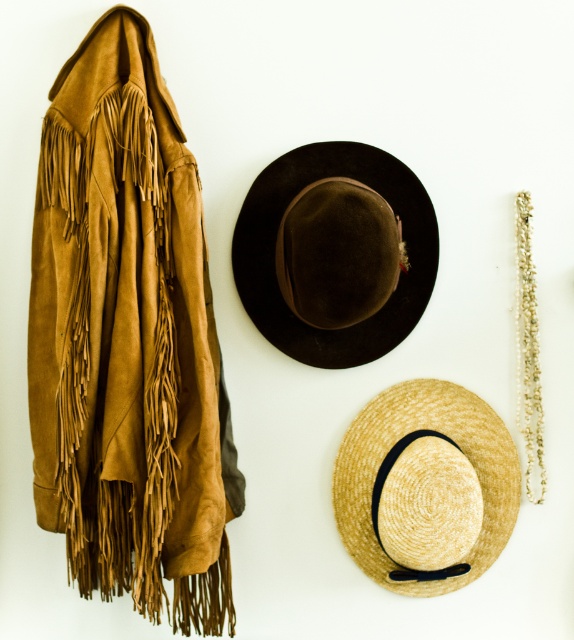
Question: Which point is closer to the camera?

Choices:
 (A) woven straw hat at center
 (B) suede fringe jacket at left

Answer: (B)

Question: Is suede fringe jacket at left bigger than brown felt fedora at center?

Choices:
 (A) no
 (B) yes

Answer: (B)

Question: Estimate the real-world distances between objects in this image. Which object is farther from the woven straw hat at center?

Choices:
 (A) brown felt fedora at center
 (B) suede fringe jacket at left

Answer: (B)

Question: Which object appears farthest from the camera in this image?

Choices:
 (A) brown felt fedora at center
 (B) woven straw hat at center

Answer: (B)

Question: Is brown felt fedora at center thinner than woven straw hat at center?

Choices:
 (A) no
 (B) yes

Answer: (A)

Question: Is suede fringe jacket at left further to camera compared to woven straw hat at center?

Choices:
 (A) yes
 (B) no

Answer: (B)